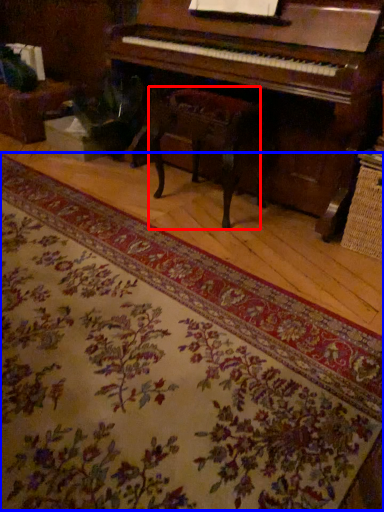
Question: Among these objects, which one is farthest to the camera, music stool (highlighted by a red box) or mat (highlighted by a blue box)?

Choices:
 (A) music stool
 (B) mat

Answer: (A)